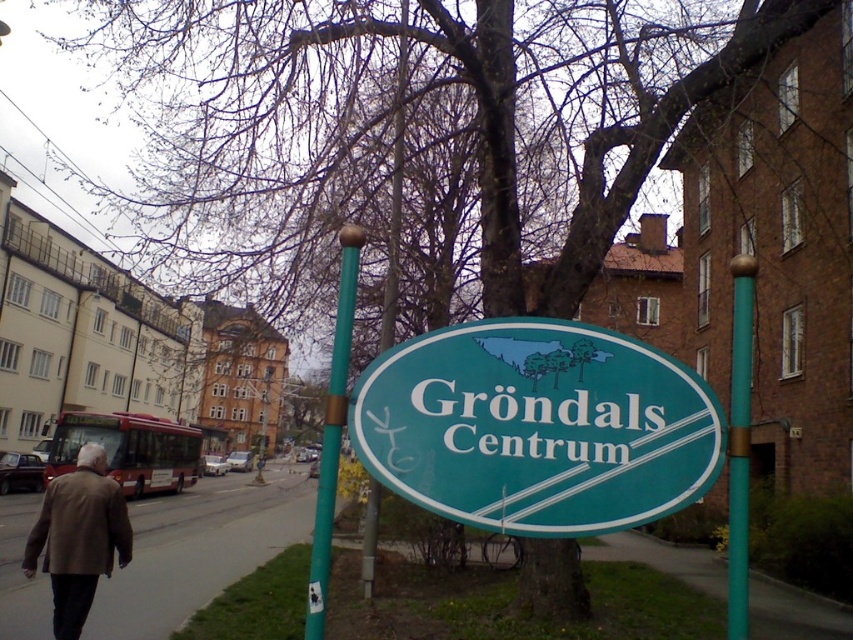
Question: Considering the real-world distances, which object is farthest from the green painted metal pole at center?

Choices:
 (A) gray asphalt at lower left
 (B) brown leather jacket at lower left
 (C) green plastic sign at center
 (D) teal painted metal pole at center

Answer: (A)

Question: Is green plastic sign at center wider than brown leather jacket at lower left?

Choices:
 (A) no
 (B) yes

Answer: (A)

Question: Is brown leather jacket at lower left closer to camera compared to teal painted metal pole at center?

Choices:
 (A) no
 (B) yes

Answer: (A)

Question: Is green plastic sign at center to the right of teal painted metal pole at center from the viewer's perspective?

Choices:
 (A) yes
 (B) no

Answer: (B)

Question: Among these objects, which one is farthest from the camera?

Choices:
 (A) teal painted metal pole at center
 (B) green plastic sign at center

Answer: (B)

Question: Which object is closer to the camera taking this photo?

Choices:
 (A) green painted metal pole at center
 (B) teal painted metal pole at center
 (C) green plastic sign at center

Answer: (B)